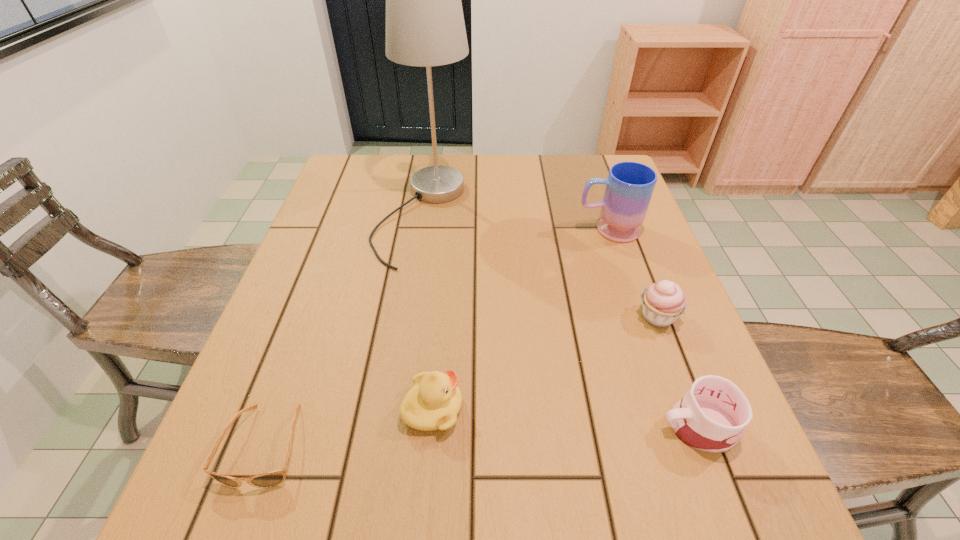
This screenshot has height=540, width=960. In order to click on table lamp in this screenshot , I will do `click(425, 27)`.

Image resolution: width=960 pixels, height=540 pixels. In order to click on the taller mug in this screenshot , I will do `click(629, 187)`.

The height and width of the screenshot is (540, 960). What are the coordinates of `the farther mug` in the screenshot? It's located at (629, 187).

Identify the location of cupcake. (663, 302).

Where is `duckling`? The width and height of the screenshot is (960, 540). duckling is located at coordinates (433, 403).

In order to click on the nearer mug in this screenshot , I will do `click(711, 417)`.

The width and height of the screenshot is (960, 540). I want to click on sunglasses, so click(x=270, y=479).

In order to click on the leftmost object in this screenshot , I will do `click(270, 479)`.

At what (x,y) coordinates should I click in order to perform the action: click on free space located on the left of the tallest object. Please return your answer as a coordinate pair (x, y). Looking at the image, I should click on (340, 215).

I want to click on free space located 0.230m on the side of the taller mug with the handle, so pos(489,230).